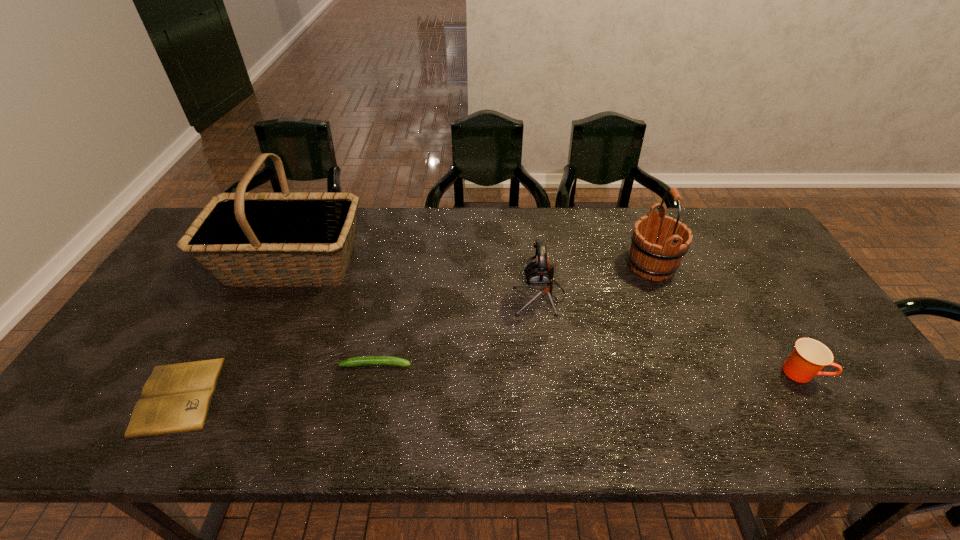
Find the location of `free space that is in between the tallest object and the third tallest object`. free space that is in between the tallest object and the third tallest object is located at coordinates (415, 280).

The image size is (960, 540). Identify the location of free point between the third tallest object and the second object from right to left. (595, 281).

Locate an element on the screen. The height and width of the screenshot is (540, 960). vacant space that's between the zucchini and the earphone is located at coordinates (458, 330).

This screenshot has width=960, height=540. In order to click on empty location between the second object from right to left and the basket in this screenshot , I will do `click(470, 265)`.

Locate an element on the screen. The width and height of the screenshot is (960, 540). vacant space in between the fifth tallest object and the book is located at coordinates (277, 380).

Locate an element on the screen. This screenshot has height=540, width=960. vacant area between the earphone and the shortest object is located at coordinates (359, 346).

Find the location of a particular element. Image resolution: width=960 pixels, height=540 pixels. vacant area that lies between the fifth shortest object and the zucchini is located at coordinates (514, 315).

At what (x,y) coordinates should I click in order to perform the action: click on vacant point located between the third tallest object and the basket. Please return your answer as a coordinate pair (x, y). Image resolution: width=960 pixels, height=540 pixels. Looking at the image, I should click on (415, 280).

At what (x,y) coordinates should I click in order to perform the action: click on vacant region between the second shortest object and the shortest object. Please return your answer as a coordinate pair (x, y). Looking at the image, I should click on (277, 380).

Identify which object is the closest to the earphone. Please provide its 2D coordinates. Your answer should be formatted as a tuple, i.e. [(x, y)], where the tuple contains the x and y coordinates of a point satisfying the conditions above.

[(659, 243)]